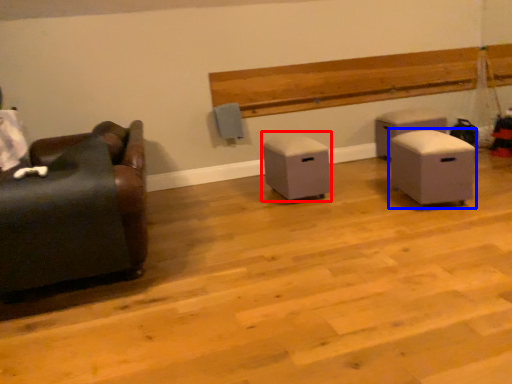
Question: Which of the following is the closest to the observer, furniture (highlighted by a red box) or furniture (highlighted by a blue box)?

Choices:
 (A) furniture
 (B) furniture

Answer: (B)